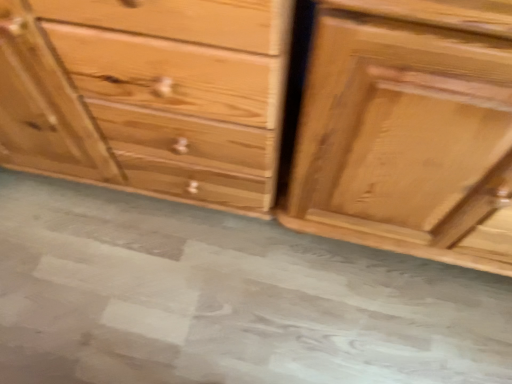
In order to click on shiny brown wood drawer at right, the 1th chest of drawers viewed from the right in this screenshot , I will do `click(406, 131)`.

Describe the element at coordinates (406, 131) in the screenshot. The height and width of the screenshot is (384, 512). I see `shiny brown wood drawer at right, the 1th chest of drawers viewed from the right` at that location.

Where is `gray concrete at center`? The image size is (512, 384). gray concrete at center is located at coordinates (226, 299).

How different are the orientations of gray concrete at center and shiny brown wood drawer at right, the 1th chest of drawers viewed from the right, in degrees?

gray concrete at center and shiny brown wood drawer at right, the 1th chest of drawers viewed from the right, are facing 1.33 degrees away from each other.

Considering the relative sizes of gray concrete at center and shiny brown wood drawer at right, which is the 2th chest of drawers from left to right, in the image provided, is gray concrete at center shorter than shiny brown wood drawer at right, which is the 2th chest of drawers from left to right,?

Yes, gray concrete at center is shorter than shiny brown wood drawer at right, which is the 2th chest of drawers from left to right.

Is gray concrete at center positioned beyond the bounds of shiny brown wood drawer at right, which is the 2th chest of drawers from left to right?

Yes, gray concrete at center is not within shiny brown wood drawer at right, which is the 2th chest of drawers from left to right.

From a real-world perspective, relative to shiny brown wood drawer at right, the 1th chest of drawers viewed from the right, is gray concrete at center vertically above or below?

In terms of real-world spatial position, gray concrete at center is below shiny brown wood drawer at right, the 1th chest of drawers viewed from the right.

Can you confirm if shiny brown wood drawer at right, the 1th chest of drawers viewed from the right, is shorter than natural wood chest of drawers at center, which is counted as the second chest of drawers, starting from the right?

No.

Is point (444, 233) in front of point (274, 160)?

That is False.

How distant is shiny brown wood drawer at right, which is the 2th chest of drawers from left to right, from natural wood chest of drawers at center, which is the first chest of drawers in left-to-right order?

shiny brown wood drawer at right, which is the 2th chest of drawers from left to right, is 10.40 inches away from natural wood chest of drawers at center, which is the first chest of drawers in left-to-right order.

Between shiny brown wood drawer at right, which is the 2th chest of drawers from left to right, and natural wood chest of drawers at center, which is the first chest of drawers in left-to-right order, which one has larger width?

natural wood chest of drawers at center, which is the first chest of drawers in left-to-right order, is wider.

Would you say shiny brown wood drawer at right, the 1th chest of drawers viewed from the right, is to the left or to the right of gray concrete at center in the picture?

In the image, shiny brown wood drawer at right, the 1th chest of drawers viewed from the right, appears on the right side of gray concrete at center.

Is shiny brown wood drawer at right, which is the 2th chest of drawers from left to right, wider or thinner than gray concrete at center?

shiny brown wood drawer at right, which is the 2th chest of drawers from left to right, is thinner than gray concrete at center.

How different are the orientations of shiny brown wood drawer at right, which is the 2th chest of drawers from left to right, and gray concrete at center in degrees?

The angular difference between shiny brown wood drawer at right, which is the 2th chest of drawers from left to right, and gray concrete at center is 1.33 degrees.

Is shiny brown wood drawer at right, the 1th chest of drawers viewed from the right, facing towards gray concrete at center?

No, shiny brown wood drawer at right, the 1th chest of drawers viewed from the right, is not turned towards gray concrete at center.

Which is more to the left, natural wood chest of drawers at center, which is counted as the second chest of drawers, starting from the right, or shiny brown wood drawer at right, the 1th chest of drawers viewed from the right?

natural wood chest of drawers at center, which is counted as the second chest of drawers, starting from the right, is more to the left.

Between natural wood chest of drawers at center, which is counted as the second chest of drawers, starting from the right, and shiny brown wood drawer at right, the 1th chest of drawers viewed from the right, which one has smaller size?

With smaller size is shiny brown wood drawer at right, the 1th chest of drawers viewed from the right.

From the image's perspective, who appears lower, natural wood chest of drawers at center, which is the first chest of drawers in left-to-right order, or shiny brown wood drawer at right, the 1th chest of drawers viewed from the right?

shiny brown wood drawer at right, the 1th chest of drawers viewed from the right, appears lower in the image.

Which object is more forward, natural wood chest of drawers at center, which is counted as the second chest of drawers, starting from the right, or shiny brown wood drawer at right, which is the 2th chest of drawers from left to right?

shiny brown wood drawer at right, which is the 2th chest of drawers from left to right.

From a real-world perspective, is gray concrete at center physically located above or below natural wood chest of drawers at center, which is the first chest of drawers in left-to-right order?

From a real-world perspective, gray concrete at center is physically below natural wood chest of drawers at center, which is the first chest of drawers in left-to-right order.

Does point (453, 380) come farther from viewer compared to point (187, 10)?

Yes, it is.

Does gray concrete at center contain natural wood chest of drawers at center, which is the first chest of drawers in left-to-right order?

No.

Does natural wood chest of drawers at center, which is the first chest of drawers in left-to-right order, turn towards gray concrete at center?

Yes, natural wood chest of drawers at center, which is the first chest of drawers in left-to-right order, is aimed at gray concrete at center.

Can you confirm if natural wood chest of drawers at center, which is counted as the second chest of drawers, starting from the right, is wider than gray concrete at center?

No.

Is natural wood chest of drawers at center, which is the first chest of drawers in left-to-right order, smaller than gray concrete at center?

Incorrect, natural wood chest of drawers at center, which is the first chest of drawers in left-to-right order, is not smaller in size than gray concrete at center.

Is point (270, 58) closer or farther from the camera than point (318, 259)?

Point (270, 58).

There is a gray concrete at center. In order to click on the 1st chest of drawers above it (from the image's perspective) in this screenshot , I will do `click(406, 131)`.

Locate an element on the screen. The width and height of the screenshot is (512, 384). the chest of drawers located below the natural wood chest of drawers at center, which is counted as the second chest of drawers, starting from the right (from the image's perspective) is located at coordinates (406, 131).

Based on their spatial positions, is natural wood chest of drawers at center, which is counted as the second chest of drawers, starting from the right, or shiny brown wood drawer at right, which is the 2th chest of drawers from left to right, closer to gray concrete at center?

natural wood chest of drawers at center, which is counted as the second chest of drawers, starting from the right.

Based on their spatial positions, is natural wood chest of drawers at center, which is counted as the second chest of drawers, starting from the right, or gray concrete at center further from shiny brown wood drawer at right, which is the 2th chest of drawers from left to right?

Among the two, gray concrete at center is located further to shiny brown wood drawer at right, which is the 2th chest of drawers from left to right.

Looking at the image, which one is located closer to shiny brown wood drawer at right, the 1th chest of drawers viewed from the right, gray concrete at center or natural wood chest of drawers at center, which is counted as the second chest of drawers, starting from the right?

natural wood chest of drawers at center, which is counted as the second chest of drawers, starting from the right, is closer to shiny brown wood drawer at right, the 1th chest of drawers viewed from the right.

Considering their positions, is shiny brown wood drawer at right, the 1th chest of drawers viewed from the right, positioned closer to gray concrete at center than natural wood chest of drawers at center, which is counted as the second chest of drawers, starting from the right?

Among the two, natural wood chest of drawers at center, which is counted as the second chest of drawers, starting from the right, is located nearer to gray concrete at center.

Estimate the real-world distances between objects in this image. Which object is further from natural wood chest of drawers at center, which is the first chest of drawers in left-to-right order, shiny brown wood drawer at right, the 1th chest of drawers viewed from the right, or gray concrete at center?

gray concrete at center lies further to natural wood chest of drawers at center, which is the first chest of drawers in left-to-right order, than the other object.

Based on their spatial positions, is gray concrete at center or shiny brown wood drawer at right, which is the 2th chest of drawers from left to right, further from natural wood chest of drawers at center, which is the first chest of drawers in left-to-right order?

gray concrete at center is positioned further to the anchor natural wood chest of drawers at center, which is the first chest of drawers in left-to-right order.

Image resolution: width=512 pixels, height=384 pixels. I want to click on concrete located between natural wood chest of drawers at center, which is counted as the second chest of drawers, starting from the right, and shiny brown wood drawer at right, the 1th chest of drawers viewed from the right, in the left-right direction, so click(226, 299).